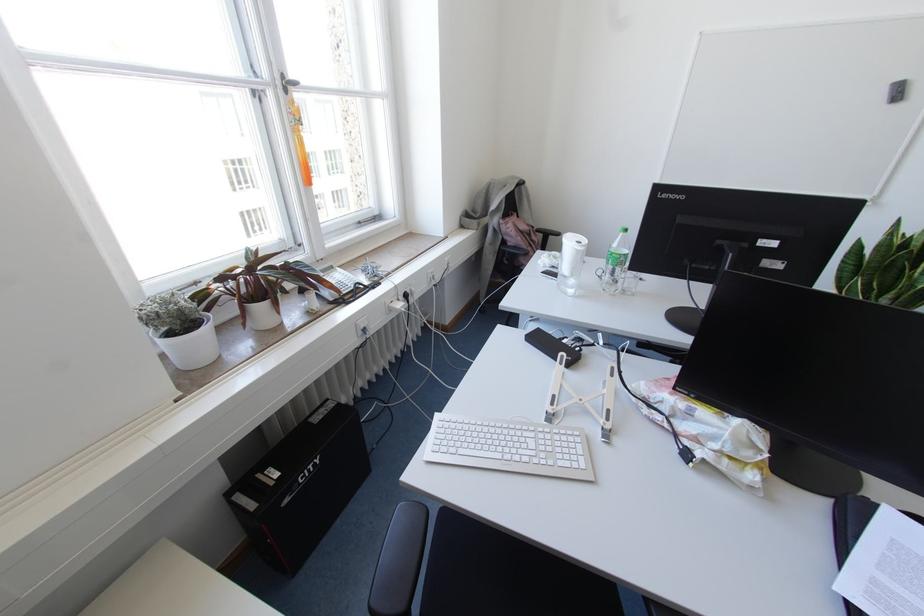
Describe the element at coordinates (399, 561) in the screenshot. I see `the black chair armrest` at that location.